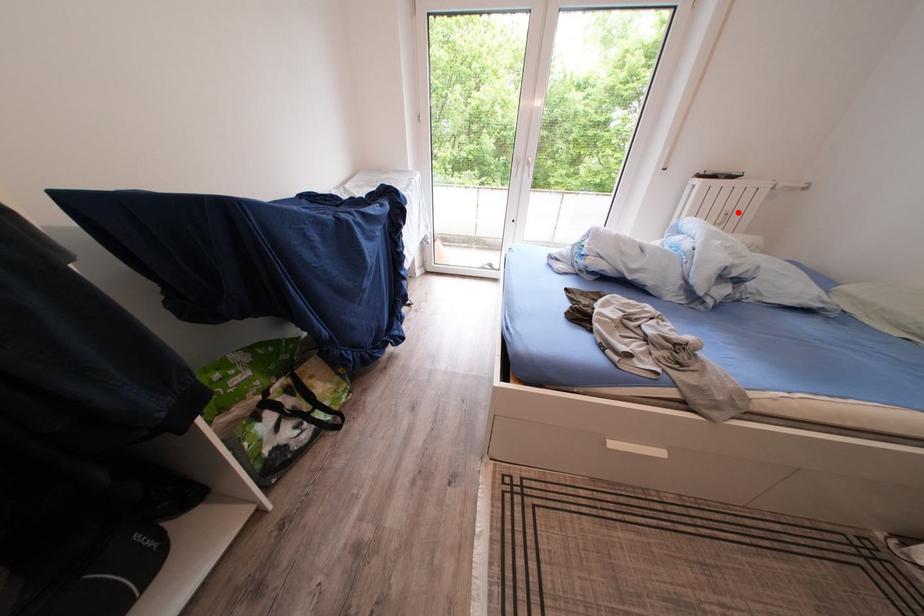
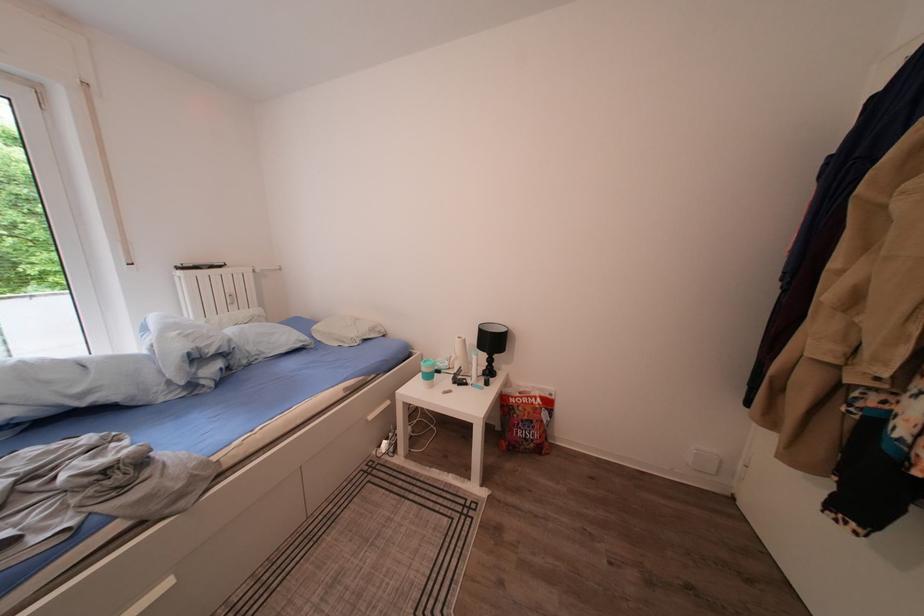
Question: I am providing you with two images of the same scene from different viewpoints. Given a red point in image1, look at the same physical point in image2. Is it:

Choices:
 (A) Closer to the viewpoint
 (B) Farther from the viewpoint

Answer: (A)